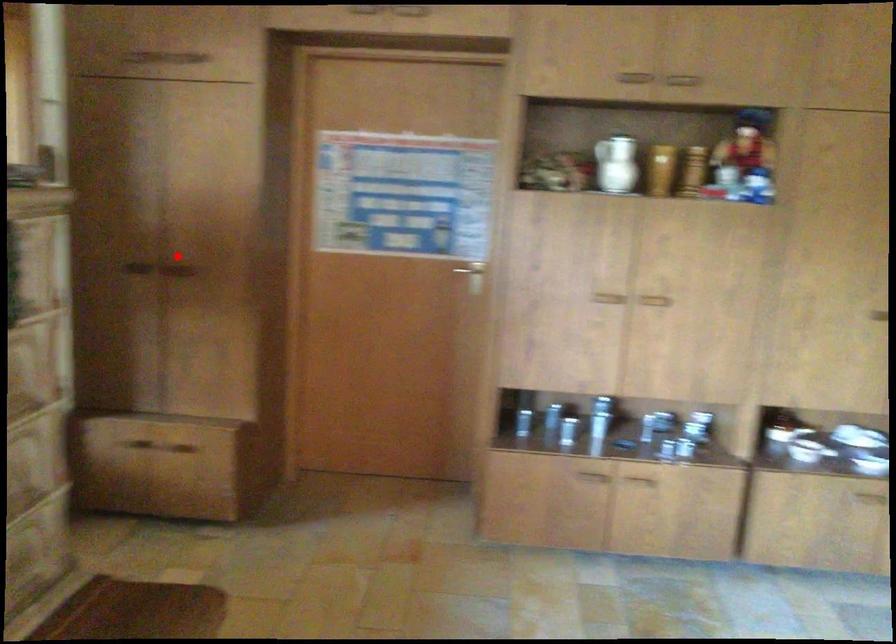
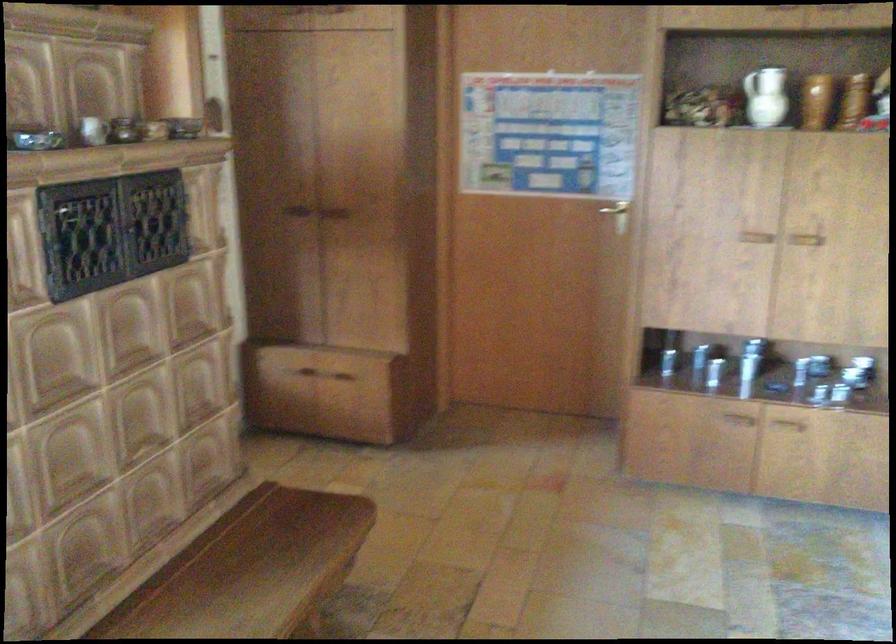
The point at the highlighted location is marked in the first image. Where is the corresponding point in the second image?

(333, 200)